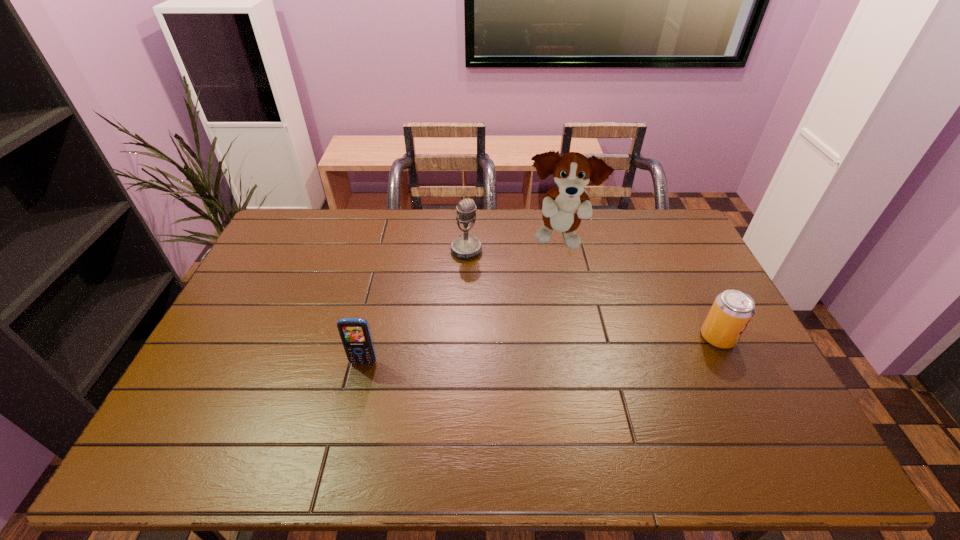
Where is `the leftmost object`? the leftmost object is located at coordinates (355, 334).

Where is `cellular telephone`? Image resolution: width=960 pixels, height=540 pixels. cellular telephone is located at coordinates (355, 334).

Find the location of a particular element. pop (soda) is located at coordinates (732, 310).

Find the location of a particular element. the shortest object is located at coordinates (732, 310).

The height and width of the screenshot is (540, 960). In order to click on puppy in this screenshot , I will do click(x=564, y=206).

The height and width of the screenshot is (540, 960). Identify the location of the tallest object. click(x=564, y=206).

Locate an element on the screen. This screenshot has height=540, width=960. microphone is located at coordinates (466, 246).

Find the location of `the second object from left to right`. the second object from left to right is located at coordinates (466, 246).

Locate an element on the screen. free space located on the screen of the nearest object is located at coordinates (358, 385).

This screenshot has height=540, width=960. I want to click on vacant space located 0.270m on the left of the rightmost object, so click(608, 338).